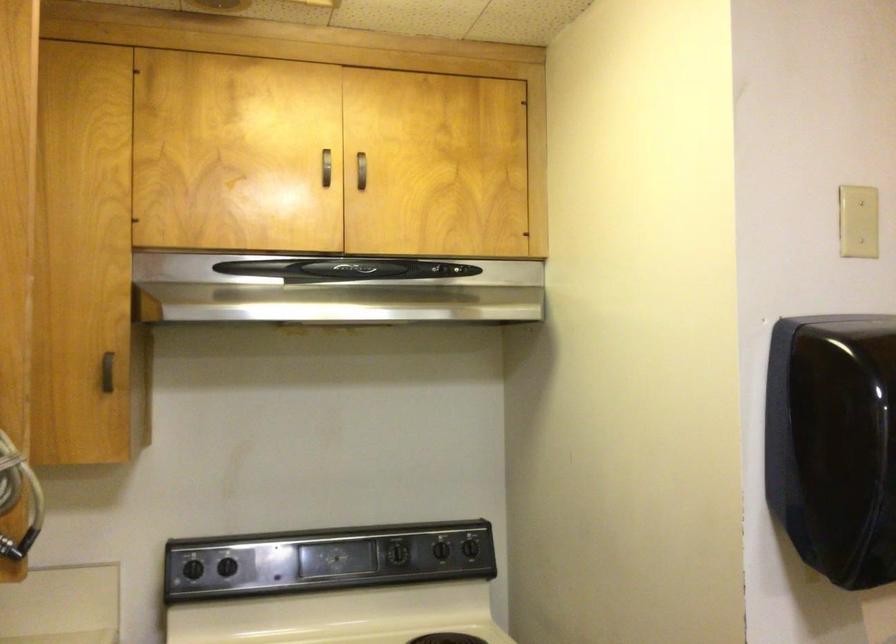
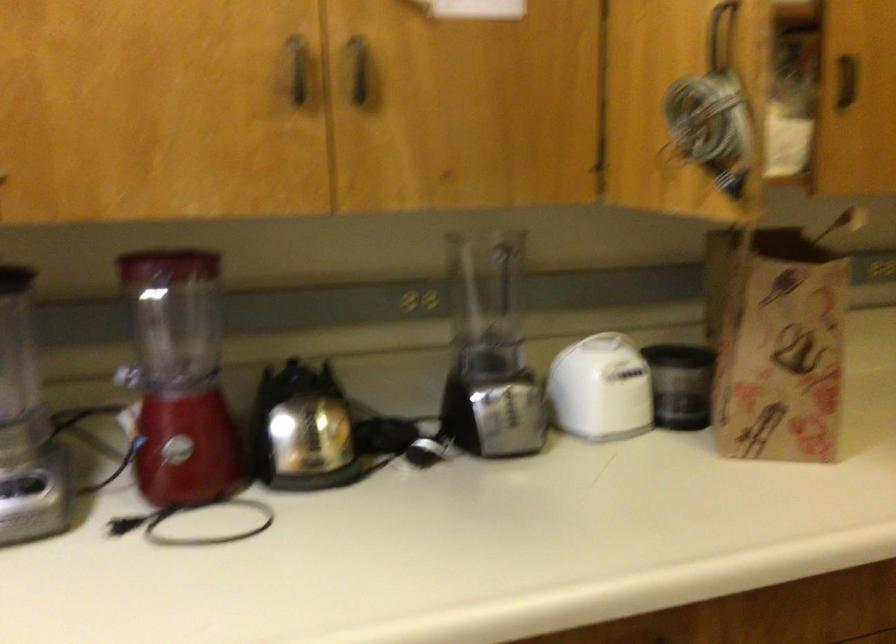
Question: The camera is either moving clockwise (left) or counter-clockwise (right) around the object. The first image is from the beginning of the video and the second image is from the end. Is the camera moving left or right when shooting the video?

Choices:
 (A) Left
 (B) Right

Answer: (B)